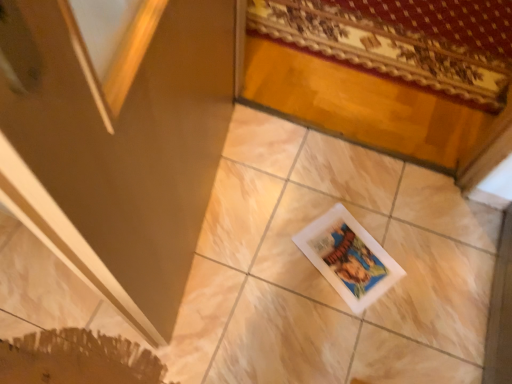
Where is `free space below white matte picture frame at center (from a real-world perspective)`? The height and width of the screenshot is (384, 512). free space below white matte picture frame at center (from a real-world perspective) is located at coordinates (347, 261).